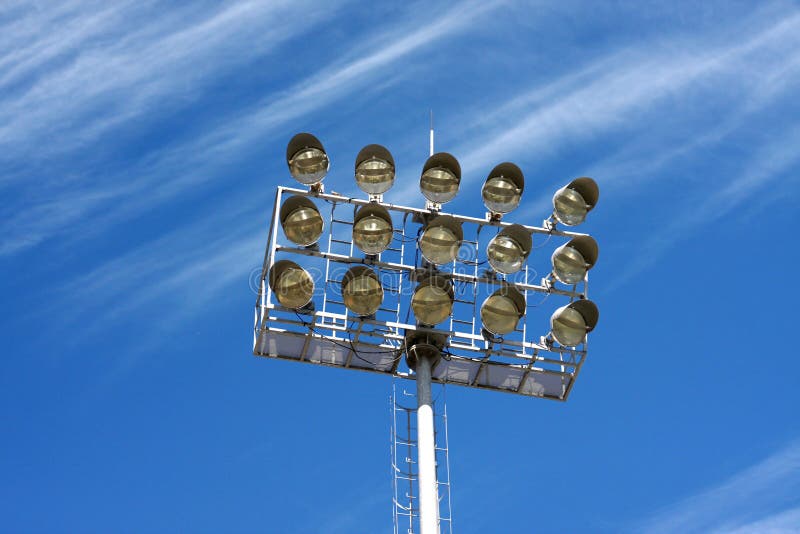
The height and width of the screenshot is (534, 800). Identify the location of top row of lights. (306, 160), (370, 160), (441, 176), (502, 182), (562, 197).